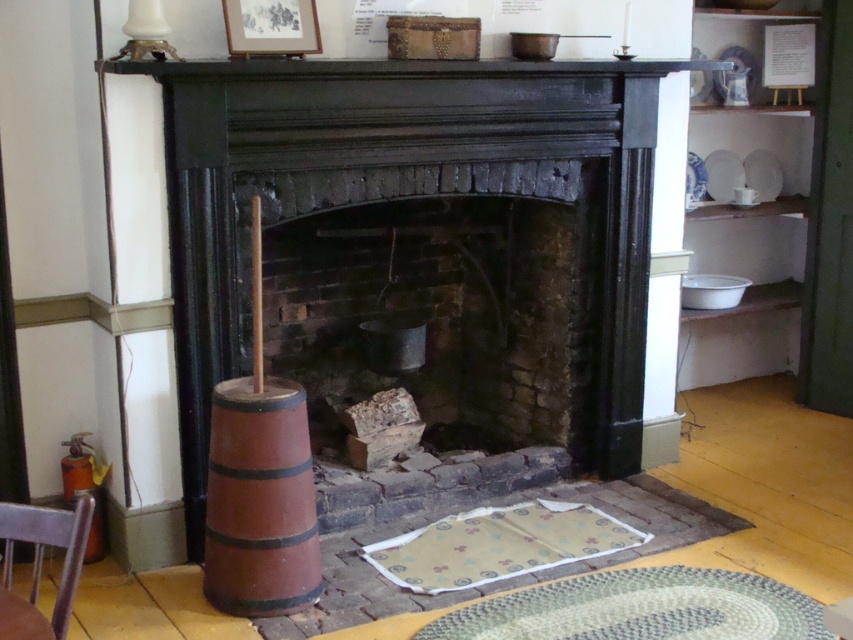
You are a visitor in this rustic room and want to take a photo of the brown wooden barrel at left and the black painted wood fireplace at center. Which object will appear smaller in your photo?

The brown wooden barrel at left appears smaller in the photo because it is positioned behind the black painted wood fireplace at center, making it farther away from the camera and thus appearing smaller.

In the scene shown: You are a visitor in this rustic room and want to hang a small painting on the wall. The painting is 1 meter tall. Can you hang it above the black painted wood fireplace at center without it touching the ceiling? Consider the height of the fireplace compared to the brown wooden barrel at left.

The black painted wood fireplace at center is much taller than the brown wooden barrel at left. Since the fireplace is taller, hanging a 1 meter tall painting above it might still leave enough space below the ceiling, but we need more information about the ceiling height to be certain. However, since the fireplace itself is significantly taller than the barrel, it suggests the fireplace could occupy a substantial portion of the wall space. Without specific measurements of the ceiling height, it is uncertain